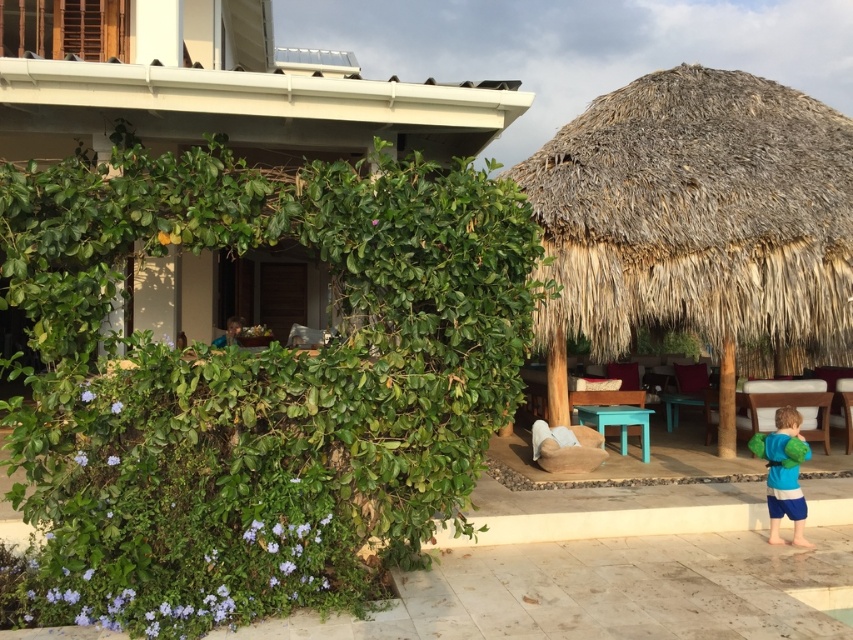
You are a visitor at this tropical resort and see the thatched straw hut at right and the blue fleece jacket at lower right. Which object is closer to you?

The thatched straw hut at right is closer to you because the blue fleece jacket at lower right is behind it, meaning the jacket is farther away.

You are standing in the tropical garden and want to walk from the green bush with purple flowers to the thatched roof hut. Which point, point [795,273] or point [792,499], is closer to you as you start your journey?

Point [795,273] is closer to you because it is further to the viewer than point [792,499], meaning it is nearer in your line of sight when starting from the green bush with purple flowers.

You are a hiker who has just arrived at this tropical location. You need to decide whether to store your blue fleece jacket at lower right inside the thatched straw hut at right or leave it outside. Considering the height of both items, which location would allow the jacket to fit without any issues?

The thatched straw hut at right has a greater height compared to the blue fleece jacket at lower right, so storing the blue fleece jacket at lower right inside the thatched straw hut at right would allow it to fit without any issues.